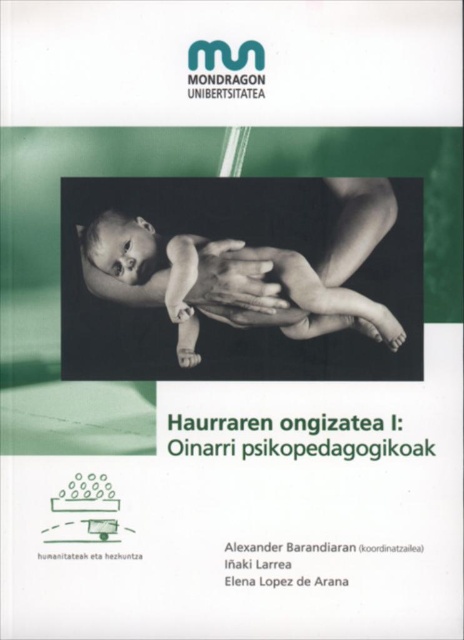
You are a graphic designer reviewing the book cover design. You notice two points marked on the cover. The first point is at coordinates point [242,241] and the second is at point [263,266]. Which of these two points is closer to the viewer?

Point [242,241] is closer to the viewer than point [263,266] because it is further to the camera.

You are a designer working on a book cover for Mondragon University. The cover currently has a smooth skin baby at center and a matte skin hand at center. The client wants to ensure that the baby is the focal point. Based on the provided information, which object should be placed closer to the viewer to achieve this?

The smooth skin baby at center should be placed closer to the viewer since it has a larger size compared to the matte skin hand at center, making it naturally draw more attention as the focal point.

Looking at the book cover, there is a smooth skin baby at center and a matte skin hand at center. Which object is located more to the left?

The smooth skin baby at center is positioned more to the left than the matte skin hand at center.